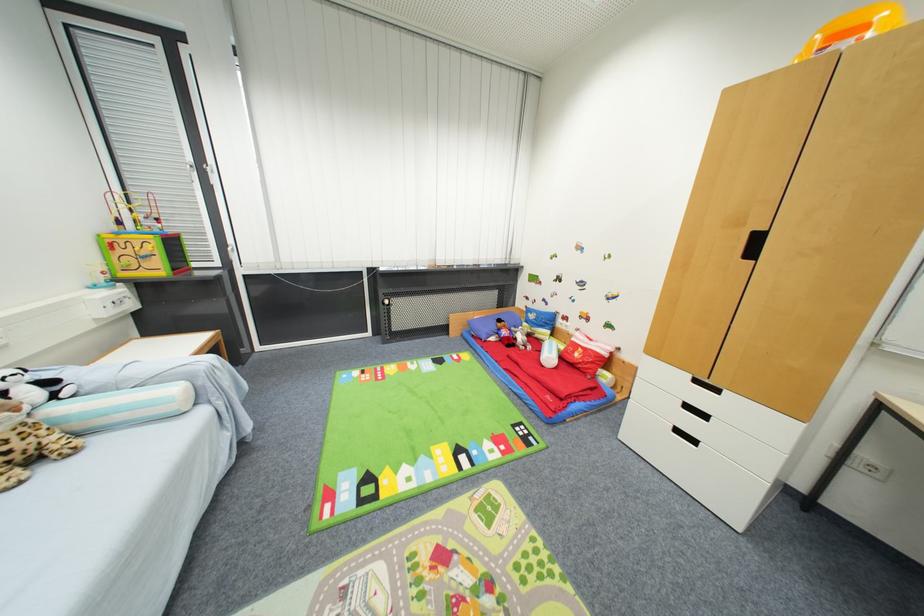
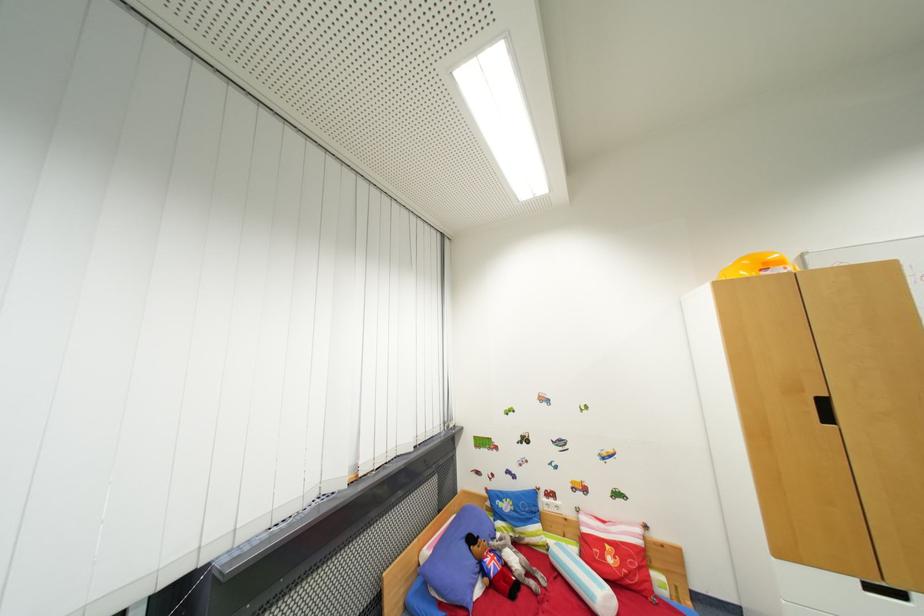
Find the pixel in the second image that matches [581,357] in the first image.

(614, 562)